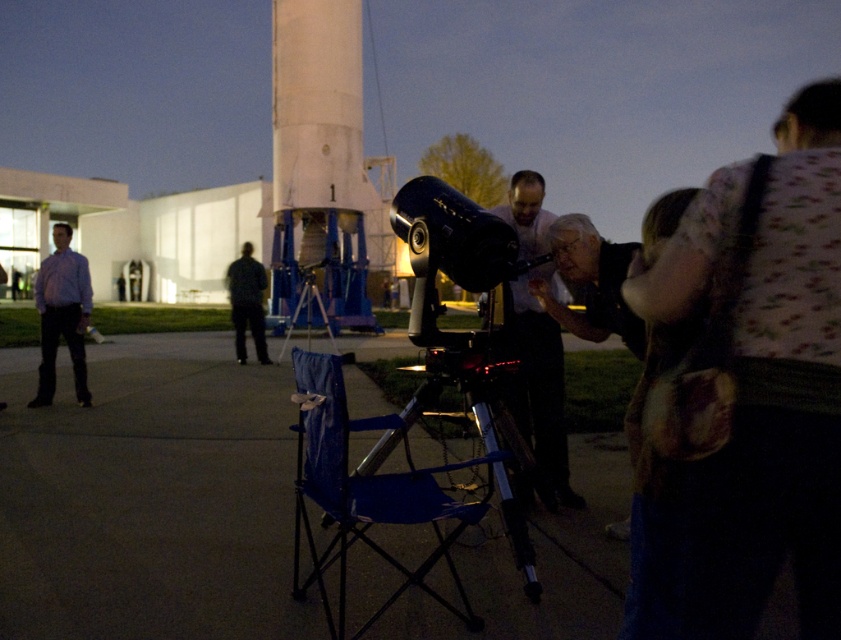
Is light purple shirt at left thinner than dark gray fabric pants at lower left?

No, light purple shirt at left is not thinner than dark gray fabric pants at lower left.

Which is in front, point (83, 301) or point (263, 342)?

Point (83, 301) is more forward.

What are the coordinates of `light purple shirt at left` in the screenshot? It's located at (62, 314).

Does matte black telescope at center have a greater width compared to metallic silver tripod at center?

Yes, matte black telescope at center is wider than metallic silver tripod at center.

This screenshot has height=640, width=841. In order to click on matte black telescope at center in this screenshot , I will do `click(540, 387)`.

Find the location of a particular element. The width and height of the screenshot is (841, 640). matte black telescope at center is located at coordinates (540, 387).

Who is positioned more to the right, white matte rocket at center or matte black telescope at center?

matte black telescope at center is more to the right.

Image resolution: width=841 pixels, height=640 pixels. I want to click on white matte rocket at center, so click(321, 163).

Where is `white matte rocket at center`? white matte rocket at center is located at coordinates (321, 163).